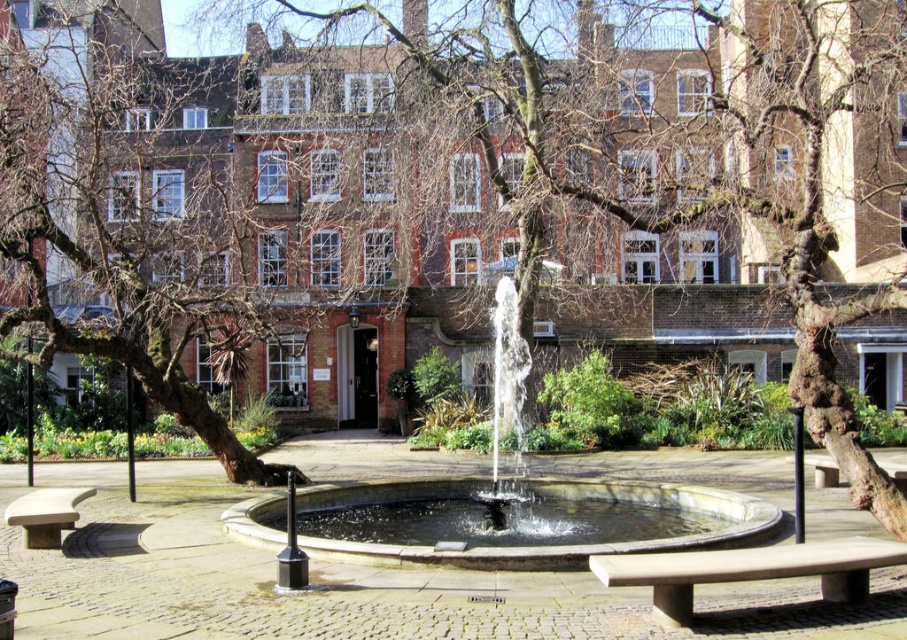
Question: Considering the relative positions of clear glass fountain at center and smooth stone bench at lower left in the image provided, where is clear glass fountain at center located with respect to smooth stone bench at lower left?

Choices:
 (A) right
 (B) left

Answer: (A)

Question: From the image, what is the correct spatial relationship of bare bark tree at center in relation to smooth stone bench at lower left?

Choices:
 (A) above
 (B) below

Answer: (A)

Question: Which point is farther to the camera?

Choices:
 (A) (684, 541)
 (B) (708, 534)
 (C) (44, 545)

Answer: (C)

Question: Which point is closer to the camera?

Choices:
 (A) (642, 564)
 (B) (405, 552)

Answer: (A)

Question: Estimate the real-world distances between objects in this image. Which object is farther from the brown bark tree at left?

Choices:
 (A) clear glass fountain at center
 (B) bare bark tree at center
 (C) smooth stone bench at lower left

Answer: (A)

Question: Is smooth stone fountain at center behind smooth stone bench at lower left?

Choices:
 (A) no
 (B) yes

Answer: (A)